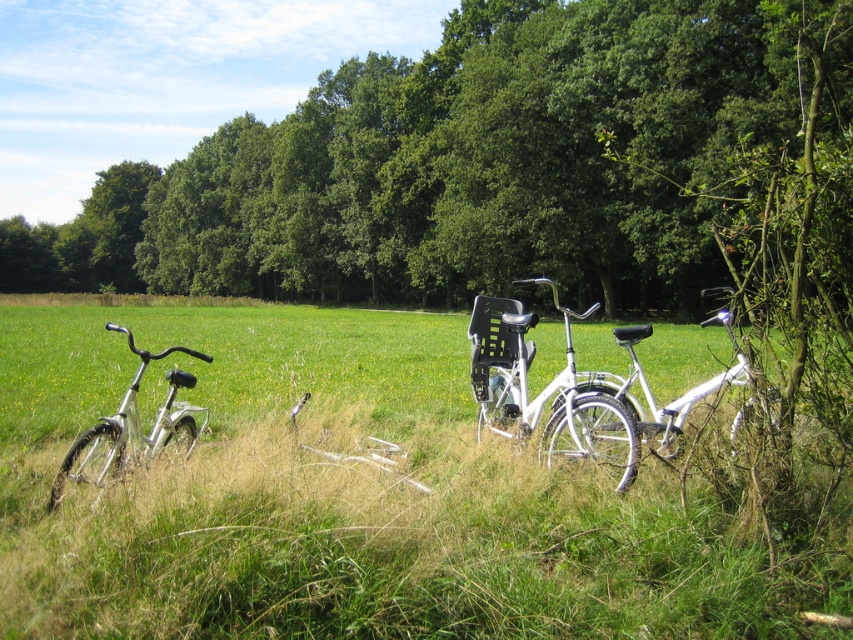
Between point (206, 406) and point (701, 323), which one is positioned in front?

Positioned in front is point (206, 406).

Who is more forward, [57,474] or [631,355]?

Point [57,474]

Identify the location of silver metallic bicycle at left. (132, 428).

Is white matte bicycle at center positioned before silver metallic bicycle at left?

No, white matte bicycle at center is behind silver metallic bicycle at left.

Describe the element at coordinates (546, 392) in the screenshot. The height and width of the screenshot is (640, 853). I see `white matte bicycle at center` at that location.

Where is `white matte bicycle at center`? The width and height of the screenshot is (853, 640). white matte bicycle at center is located at coordinates (546, 392).

Between green leafy tree at center and white matte bicycle at right, which one has less height?

With less height is white matte bicycle at right.

What do you see at coordinates (468, 163) in the screenshot? I see `green leafy tree at center` at bounding box center [468, 163].

Which is behind, point (701, 172) or point (646, 396)?

Positioned behind is point (701, 172).

You are a GUI agent. You are given a task and a screenshot of the screen. Output one action in this format:
    pyautogui.click(x=<x>, y=<y>)
    Task: Click on the green leafy tree at center
    The image size is (853, 640).
    Given the screenshot: What is the action you would take?
    pyautogui.click(x=468, y=163)